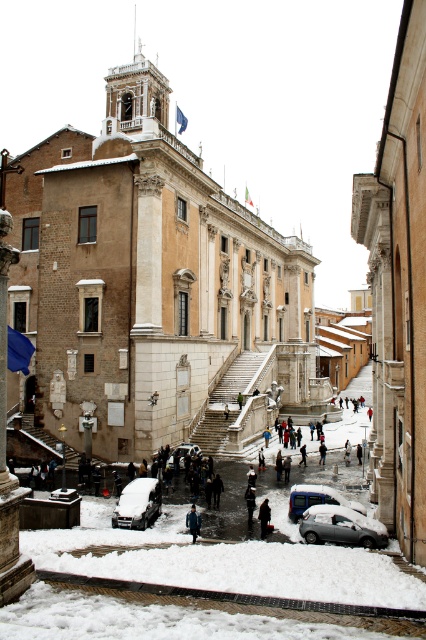
You are a delivery person needing to park your 1.8 meters wide van in this snowy scene. The parking spot is between the sleek silver sedan at center and the dark gray fabric coat at lower center. Can your van fit in that space?

The sleek silver sedan at center is wider than the dark gray fabric coat at lower center. Since the van is 1.8 meters wide, and the space between them must accommodate this width, the answer depends on the total available space. However, the description only states the sedan is wider, not the exact dimensions. Without specific measurements, we cannot confirm if the van will fit. Please check the actual space.

You are a photographer trying to capture both the white marble stairs at center and the dark gray fabric coat at lower center in a single frame. Which object will appear larger in your photo?

The white marble stairs at center will appear larger in the photo because it is bigger than the dark gray fabric coat at lower center.